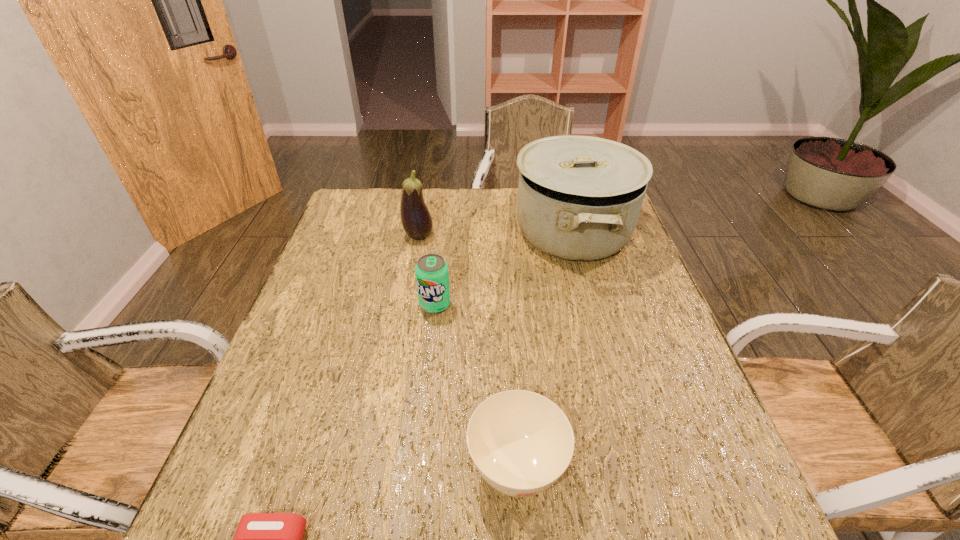
You are a GUI agent. You are given a task and a screenshot of the screen. Output one action in this format:
    pyautogui.click(x=<x>, y=<y>)
    Task: Click on the object that is at the far edge
    
    Given the screenshot: What is the action you would take?
    pyautogui.click(x=579, y=198)

Image resolution: width=960 pixels, height=540 pixels. In order to click on object that is at the near edge in this screenshot , I will do `click(521, 442)`.

Locate an element on the screen. The image size is (960, 540). object present at the right edge is located at coordinates (579, 198).

At what (x,y) coordinates should I click in order to perform the action: click on object present at the far right corner. Please return your answer as a coordinate pair (x, y). The height and width of the screenshot is (540, 960). Looking at the image, I should click on (579, 198).

Locate an element on the screen. vacant space at the far edge of the desktop is located at coordinates (482, 214).

I want to click on vacant space at the near edge, so tap(636, 524).

In the image, there is a desktop. Where is `vacant space at the left edge`? This screenshot has width=960, height=540. vacant space at the left edge is located at coordinates (231, 463).

The height and width of the screenshot is (540, 960). In order to click on free region at the right edge of the desktop in this screenshot , I will do `click(703, 419)`.

Where is `vacant region at the far left corner of the desktop`? The width and height of the screenshot is (960, 540). vacant region at the far left corner of the desktop is located at coordinates click(383, 195).

Locate an element on the screen. free spot at the near right corner of the desktop is located at coordinates (687, 524).